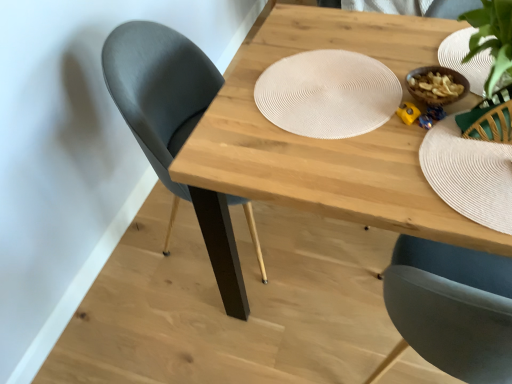
Question: Could white woven placemat at center be considered to be inside matte black chair at left?

Choices:
 (A) no
 (B) yes

Answer: (A)

Question: Is matte black chair at left far away from white woven placemat at center?

Choices:
 (A) yes
 (B) no

Answer: (B)

Question: Does matte black chair at left touch white woven placemat at center?

Choices:
 (A) no
 (B) yes

Answer: (A)

Question: Considering the relative sizes of matte black chair at left and white woven placemat at center in the image provided, is matte black chair at left thinner than white woven placemat at center?

Choices:
 (A) yes
 (B) no

Answer: (B)

Question: Does matte black chair at left have a smaller size compared to white woven placemat at center?

Choices:
 (A) no
 (B) yes

Answer: (A)

Question: Based on their sizes in the image, would you say natural wood table at center is bigger or smaller than matte black chair at left?

Choices:
 (A) small
 (B) big

Answer: (B)

Question: Relative to matte black chair at left, is natural wood table at center in front or behind?

Choices:
 (A) front
 (B) behind

Answer: (A)

Question: Is natural wood table at center wider or thinner than matte black chair at left?

Choices:
 (A) wide
 (B) thin

Answer: (A)

Question: From the image's perspective, is natural wood table at center positioned above or below matte black chair at left?

Choices:
 (A) above
 (B) below

Answer: (B)

Question: From a real-world perspective, is white woven placemat at center above or below white textured paper plate at upper right?

Choices:
 (A) below
 (B) above

Answer: (B)

Question: From the image's perspective, relative to white textured paper plate at upper right, is white woven placemat at center above or below?

Choices:
 (A) below
 (B) above

Answer: (A)

Question: Would you say white woven placemat at center is inside or outside white textured paper plate at upper right?

Choices:
 (A) outside
 (B) inside

Answer: (A)

Question: Is white woven placemat at center bigger or smaller than white textured paper plate at upper right?

Choices:
 (A) small
 (B) big

Answer: (B)

Question: Is point (185, 185) positioned closer to the camera than point (374, 125)?

Choices:
 (A) farther
 (B) closer

Answer: (A)

Question: From a real-world perspective, is matte black chair at left above or below white woven placemat at center?

Choices:
 (A) above
 (B) below

Answer: (B)